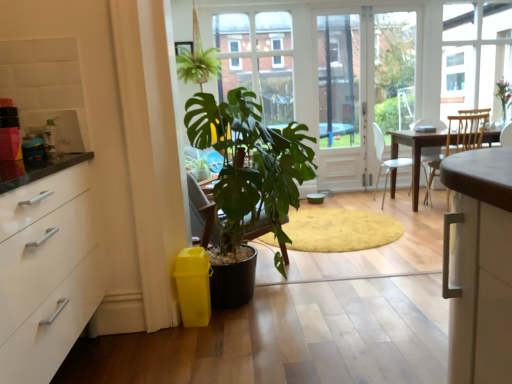
Question: Does metallic silver kettle at upper left have a greater height compared to white plastic chair at center?

Choices:
 (A) yes
 (B) no

Answer: (B)

Question: Does metallic silver kettle at upper left have a smaller size compared to white plastic chair at center?

Choices:
 (A) no
 (B) yes

Answer: (B)

Question: Is metallic silver kettle at upper left closer to camera compared to white plastic chair at center?

Choices:
 (A) yes
 (B) no

Answer: (A)

Question: From a real-world perspective, is metallic silver kettle at upper left under white plastic chair at center?

Choices:
 (A) no
 (B) yes

Answer: (A)

Question: Does metallic silver kettle at upper left turn towards white plastic chair at center?

Choices:
 (A) no
 (B) yes

Answer: (A)

Question: From the image's perspective, is metallic silver kettle at upper left on white plastic chair at center?

Choices:
 (A) yes
 (B) no

Answer: (B)

Question: Is transparent glass screen door at center aimed at green matte plant at center?

Choices:
 (A) no
 (B) yes

Answer: (A)

Question: Is there a large distance between transparent glass screen door at center and green matte plant at center?

Choices:
 (A) yes
 (B) no

Answer: (A)

Question: From the image's perspective, does transparent glass screen door at center appear lower than green matte plant at center?

Choices:
 (A) no
 (B) yes

Answer: (A)

Question: From a real-world perspective, is transparent glass screen door at center below green matte plant at center?

Choices:
 (A) yes
 (B) no

Answer: (B)

Question: From a real-world perspective, is transparent glass screen door at center physically above green matte plant at center?

Choices:
 (A) yes
 (B) no

Answer: (A)

Question: Is transparent glass screen door at center at the right side of green matte plant at center?

Choices:
 (A) no
 (B) yes

Answer: (B)

Question: Is transparent glass screen door at center directly adjacent to green leafy plant at center?

Choices:
 (A) no
 (B) yes

Answer: (A)